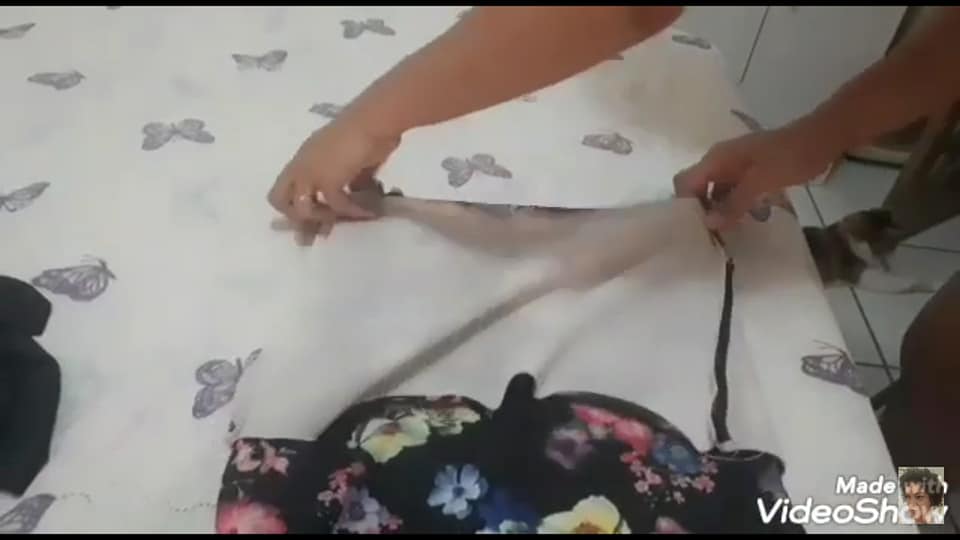
Find the location of a particular element. The image size is (960, 540). printed fabric is located at coordinates (606, 334).